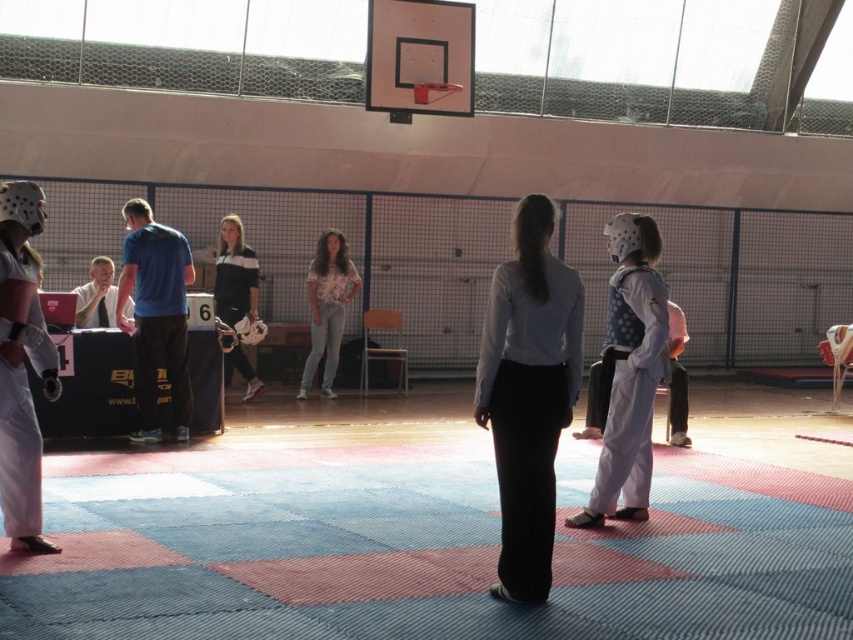
Question: Which of the following is the closest to the observer?

Choices:
 (A) (25, 525)
 (B) (576, 365)

Answer: (B)

Question: Does white smooth shirt at center appear under white matte karate uniform at center?

Choices:
 (A) yes
 (B) no

Answer: (A)

Question: Considering the relative positions of floral shirt at center and black/white jersey at center in the image provided, where is floral shirt at center located with respect to black/white jersey at center?

Choices:
 (A) right
 (B) left

Answer: (A)

Question: Which point is farther to the camera?

Choices:
 (A) (311, 284)
 (B) (155, 268)

Answer: (A)

Question: Which point is farther from the camera taking this photo?

Choices:
 (A) tap(515, 497)
 (B) tap(622, 449)
 (C) tap(103, 273)

Answer: (C)

Question: Does white smooth shirt at center have a greater width compared to floral shirt at center?

Choices:
 (A) yes
 (B) no

Answer: (B)